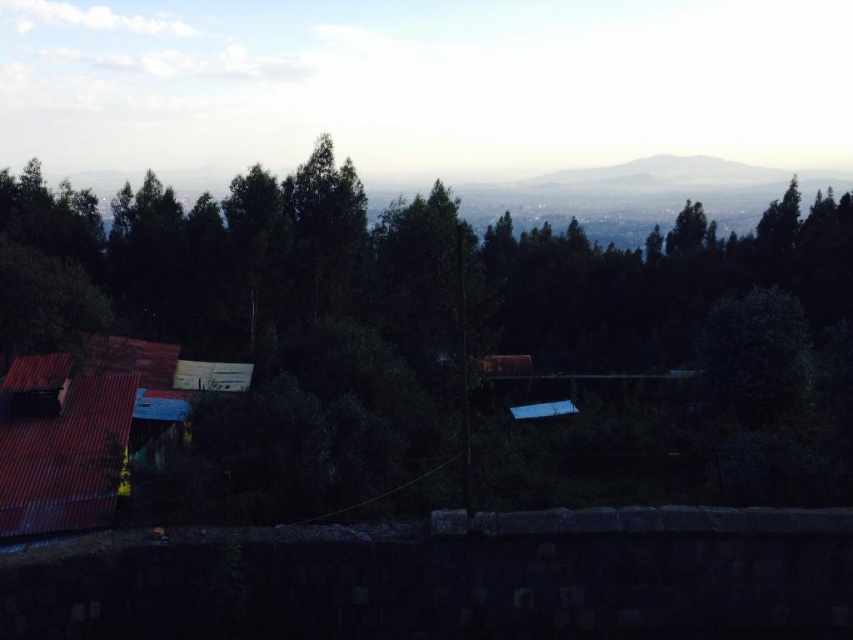
Question: Is green leafy forest at center wider than rusty corrugated metal hut at lower left?

Choices:
 (A) yes
 (B) no

Answer: (A)

Question: Which point is farther to the camera?

Choices:
 (A) (28, 372)
 (B) (625, 275)

Answer: (B)

Question: From the image, what is the correct spatial relationship of green leafy forest at center in relation to rusty corrugated metal hut at lower left?

Choices:
 (A) right
 (B) left

Answer: (A)

Question: Can you confirm if green leafy forest at center is smaller than rusty corrugated metal hut at lower left?

Choices:
 (A) no
 (B) yes

Answer: (A)

Question: Which object is closer to the camera taking this photo?

Choices:
 (A) rusty corrugated metal hut at lower left
 (B) green leafy forest at center

Answer: (B)